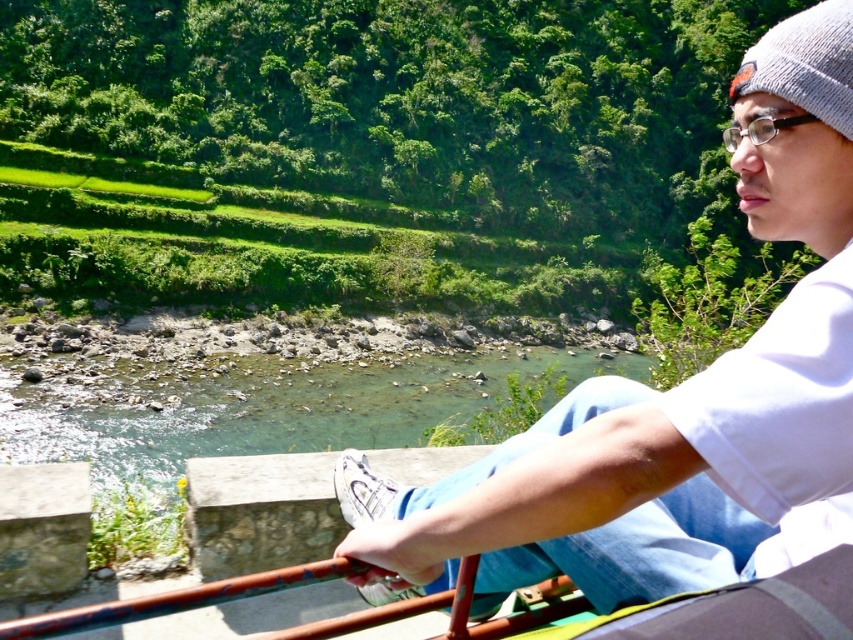
Question: Can you confirm if clear water at river center is smaller than rusty metal rail at lower center?

Choices:
 (A) no
 (B) yes

Answer: (A)

Question: Which point is closer to the camera?

Choices:
 (A) white cotton shirt at upper right
 (B) gray knit cap at upper right
 (C) rusty metal rail at lower center
 (D) clear water at river center

Answer: (A)

Question: Estimate the real-world distances between objects in this image. Which object is farther from the white cotton shirt at upper right?

Choices:
 (A) gray knit cap at upper right
 (B) rusty metal rail at lower center
 (C) clear water at river center

Answer: (C)

Question: Is white cotton shirt at upper right wider than rusty metal rail at lower center?

Choices:
 (A) no
 (B) yes

Answer: (B)

Question: Does rusty metal rail at lower center have a greater width compared to gray knit cap at upper right?

Choices:
 (A) no
 (B) yes

Answer: (A)

Question: Which point appears closest to the camera in this image?

Choices:
 (A) (204, 596)
 (B) (727, 493)

Answer: (B)